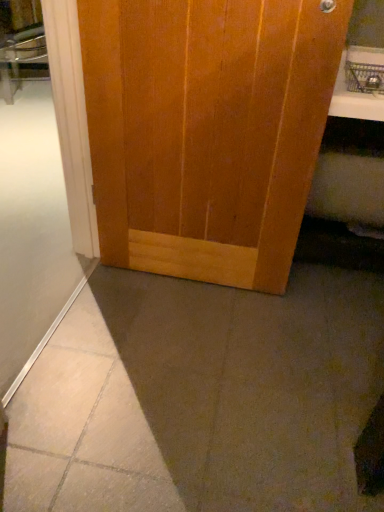
Question: Could you tell me if wooden door at center is turned towards white frosted glass at lower left?

Choices:
 (A) yes
 (B) no

Answer: (A)

Question: Does wooden door at center appear on the right side of white frosted glass at lower left?

Choices:
 (A) no
 (B) yes

Answer: (B)

Question: Is wooden door at center smaller than white frosted glass at lower left?

Choices:
 (A) yes
 (B) no

Answer: (A)

Question: Is wooden door at center facing away from white frosted glass at lower left?

Choices:
 (A) yes
 (B) no

Answer: (B)

Question: Is wooden door at center at the left side of white frosted glass at lower left?

Choices:
 (A) no
 (B) yes

Answer: (A)

Question: Based on their sizes in the image, would you say white glossy counter top at upper right is bigger or smaller than wooden door at center?

Choices:
 (A) big
 (B) small

Answer: (B)

Question: Considering the positions of white glossy counter top at upper right and wooden door at center in the image, is white glossy counter top at upper right wider or thinner than wooden door at center?

Choices:
 (A) wide
 (B) thin

Answer: (A)

Question: In the image, is white glossy counter top at upper right positioned in front of or behind wooden door at center?

Choices:
 (A) front
 (B) behind

Answer: (B)

Question: From a real-world perspective, is white glossy counter top at upper right positioned above or below wooden door at center?

Choices:
 (A) above
 (B) below

Answer: (A)

Question: From the image's perspective, is white frosted glass at lower left located above or below wooden door at center?

Choices:
 (A) below
 (B) above

Answer: (A)

Question: Considering the positions of white frosted glass at lower left and wooden door at center in the image, is white frosted glass at lower left wider or thinner than wooden door at center?

Choices:
 (A) wide
 (B) thin

Answer: (A)

Question: Relative to wooden door at center, is white frosted glass at lower left in front or behind?

Choices:
 (A) front
 (B) behind

Answer: (A)

Question: From a real-world perspective, is white frosted glass at lower left physically located above or below wooden door at center?

Choices:
 (A) below
 (B) above

Answer: (A)

Question: Is white glossy counter top at upper right taller or shorter than white frosted glass at lower left?

Choices:
 (A) tall
 (B) short

Answer: (B)

Question: Considering the positions of point (345, 115) and point (26, 266), is point (345, 115) closer or farther from the camera than point (26, 266)?

Choices:
 (A) closer
 (B) farther

Answer: (A)